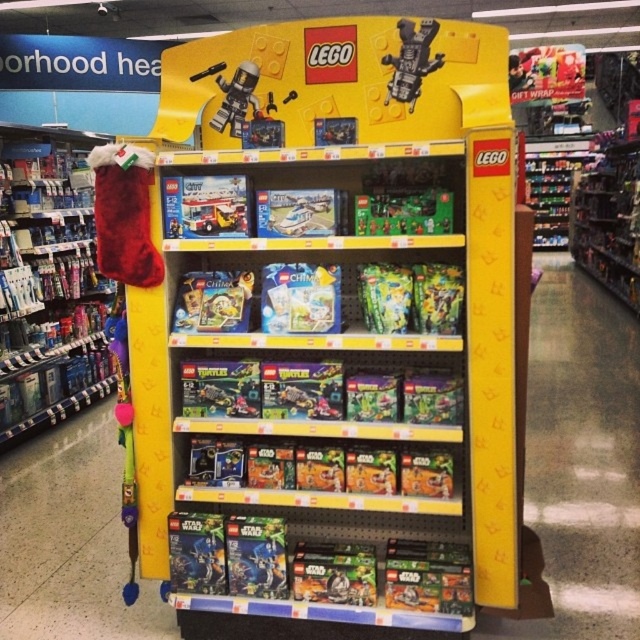
Measure the distance from velvet red stocking at left to metallic silver robot at upper center.

A distance of 3.40 meters exists between velvet red stocking at left and metallic silver robot at upper center.

Locate an element on the screen. velvet red stocking at left is located at coordinates (48, 282).

Find the location of a particular element. This screenshot has width=640, height=640. velvet red stocking at left is located at coordinates (48, 282).